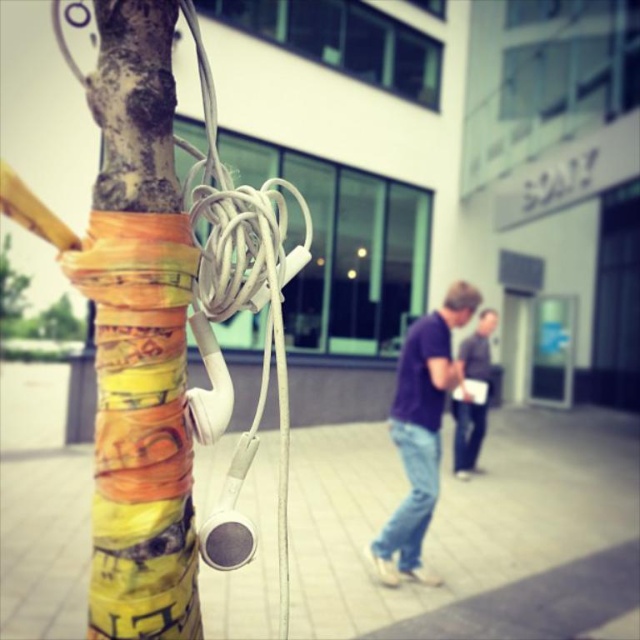
Question: Among these points, which one is nearest to the camera?

Choices:
 (A) (460, 477)
 (B) (109, 522)
 (C) (404, 403)

Answer: (B)

Question: Which object appears closest to the camera in this image?

Choices:
 (A) denim jeans at center
 (B) purple matte shirt at center
 (C) white matte pavement at lower center
 (D) multicolored paper at center

Answer: (D)

Question: Considering the relative positions of white matte pavement at lower center and purple matte shirt at center in the image provided, where is white matte pavement at lower center located with respect to purple matte shirt at center?

Choices:
 (A) below
 (B) above

Answer: (A)

Question: Which of these objects is positioned closest to the denim jeans at center?

Choices:
 (A) white matte pavement at lower center
 (B) purple matte shirt at center

Answer: (B)

Question: Considering the relative positions of purple matte shirt at center and denim jeans at center in the image provided, where is purple matte shirt at center located with respect to denim jeans at center?

Choices:
 (A) below
 (B) above

Answer: (A)

Question: Does white matte pavement at lower center appear under multicolored paper at center?

Choices:
 (A) no
 (B) yes

Answer: (B)